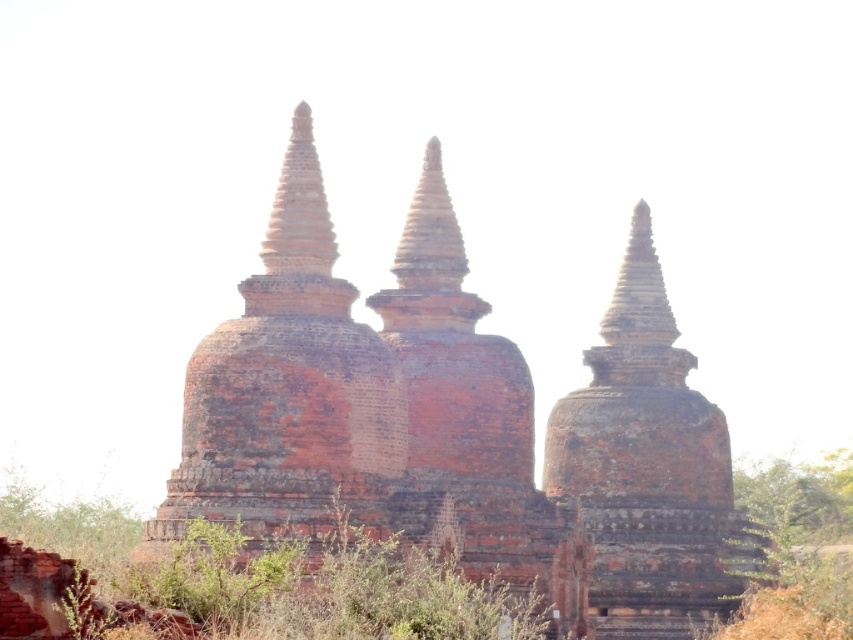
Question: Can you confirm if reddish-brown brick pagoda at center is positioned below brown grass at lower right?

Choices:
 (A) no
 (B) yes

Answer: (A)

Question: Which of the following is the closest to the observer?

Choices:
 (A) brown grass at lower right
 (B) reddish-brown brick pagoda at center

Answer: (B)

Question: Among these objects, which one is nearest to the camera?

Choices:
 (A) reddish-brown brick pagoda at center
 (B) brown grass at lower right

Answer: (A)

Question: Among these points, which one is farthest from the camera?

Choices:
 (A) (669, 605)
 (B) (807, 602)

Answer: (A)

Question: Can you confirm if reddish-brown brick pagoda at center is smaller than brown grass at lower right?

Choices:
 (A) no
 (B) yes

Answer: (A)

Question: Does reddish-brown brick pagoda at center lie in front of brown grass at lower right?

Choices:
 (A) yes
 (B) no

Answer: (A)